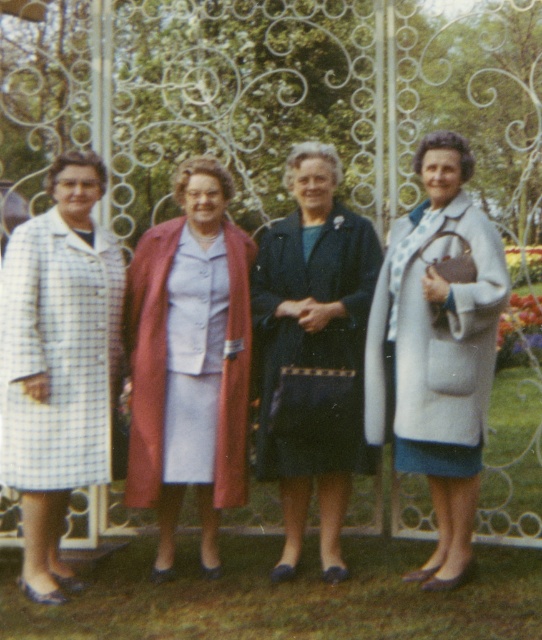
Question: Which point appears farthest from the camera in this image?

Choices:
 (A) (401, 224)
 (B) (301, 460)
 (C) (130, 476)
 (D) (16, 467)

Answer: (A)

Question: Is dark blue fabric coat at center wider than light gray wool coat at right?

Choices:
 (A) yes
 (B) no

Answer: (B)

Question: Does matte pink coat at center come in front of light gray wool coat at right?

Choices:
 (A) yes
 (B) no

Answer: (B)

Question: Which is farther from the dark blue fabric coat at center?

Choices:
 (A) checkered fabric coat at left
 (B) light gray wool coat at right

Answer: (A)

Question: Which point is closer to the camera taking this photo?

Choices:
 (A) (5, 412)
 (B) (461, 291)
 (C) (298, 269)

Answer: (B)

Question: Does matte pink coat at center have a smaller size compared to dark blue fabric coat at center?

Choices:
 (A) no
 (B) yes

Answer: (A)